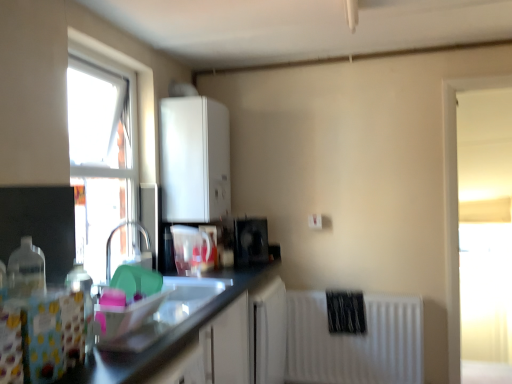
Locate an element on the screen. vacant region to the right of translucent plastic bottle at left is located at coordinates (124, 342).